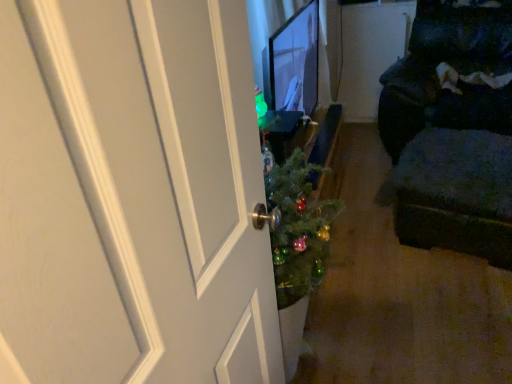
Where is `dark fabric ottoman at right`? The width and height of the screenshot is (512, 384). dark fabric ottoman at right is located at coordinates (456, 193).

I want to click on dark fabric ottoman at right, so click(x=456, y=193).

From the image's perspective, which one is positioned lower, dark fabric couch at right or dark fabric ottoman at right?

dark fabric ottoman at right, from the image's perspective.

Is dark fabric couch at right next to dark fabric ottoman at right and touching it?

No, dark fabric couch at right is not beside dark fabric ottoman at right.

At what (x,y) coordinates should I click in order to perform the action: click on the footrest located in front of the dark fabric couch at right. Please return your answer as a coordinate pair (x, y). This screenshot has height=384, width=512. Looking at the image, I should click on (456, 193).

Do you think dark fabric couch at right is within dark fabric ottoman at right, or outside of it?

dark fabric couch at right exists outside the volume of dark fabric ottoman at right.

Do you think dark fabric ottoman at right is within matte black monitor at center, or outside of it?

dark fabric ottoman at right is located beyond the bounds of matte black monitor at center.

From the picture: Which is in front, dark fabric ottoman at right or matte black monitor at center?

matte black monitor at center is closer to the camera.

Which is farther from the camera, (461, 197) or (304, 47)?

Point (304, 47)

Does dark fabric ottoman at right have a greater height compared to matte black monitor at center?

In fact, dark fabric ottoman at right may be shorter than matte black monitor at center.

From the image's perspective, is matte black monitor at center on top of dark fabric ottoman at right?

Yes, from the image's perspective, matte black monitor at center is over dark fabric ottoman at right.

Considering the sizes of matte black monitor at center and dark fabric ottoman at right in the image, is matte black monitor at center bigger or smaller than dark fabric ottoman at right?

In the image, matte black monitor at center appears to be smaller than dark fabric ottoman at right.

Considering the sizes of matte black monitor at center and dark fabric ottoman at right in the image, is matte black monitor at center wider or thinner than dark fabric ottoman at right?

matte black monitor at center is thinner than dark fabric ottoman at right.

How many degrees apart are the facing directions of matte black monitor at center and dark fabric ottoman at right?

matte black monitor at center and dark fabric ottoman at right are facing 110 degrees away from each other.

From the image's perspective, which is below, dark fabric couch at right or matte black monitor at center?

matte black monitor at center is shown below in the image.

Is matte black monitor at center at the back of dark fabric couch at right?

No, dark fabric couch at right is not facing away from matte black monitor at center.

Is dark fabric couch at right positioned beyond the bounds of matte black monitor at center?

Yes, dark fabric couch at right is located beyond the bounds of matte black monitor at center.

Does point (434, 221) come behind point (298, 27)?

Yes.

How different are the orientations of matte black monitor at center and dark fabric couch at right in degrees?

The facing directions of matte black monitor at center and dark fabric couch at right are 102 degrees apart.

Find the location of `computer monitor above the dark fabric couch at right (from a real-world perspective)`. computer monitor above the dark fabric couch at right (from a real-world perspective) is located at coordinates (293, 63).

From the image's perspective, is matte black monitor at center located above or below dark fabric couch at right?

matte black monitor at center is situated lower than dark fabric couch at right in the image.

Is dark fabric ottoman at right aimed at dark fabric couch at right?

No, dark fabric ottoman at right does not turn towards dark fabric couch at right.

Does point (423, 237) appear closer or farther from the camera than point (504, 69)?

Point (423, 237) appears to be closer to the viewer than point (504, 69).

Do you think dark fabric ottoman at right is within dark fabric couch at right, or outside of it?

dark fabric ottoman at right lies outside dark fabric couch at right.

From the image's perspective, relative to dark fabric couch at right, is dark fabric ottoman at right above or below?

From the image's perspective, dark fabric ottoman at right appears below dark fabric couch at right.

Locate an element on the screen. Image resolution: width=512 pixels, height=384 pixels. furniture above the dark fabric ottoman at right (from a real-world perspective) is located at coordinates (453, 129).

In order to click on computer monitor located in front of the dark fabric ottoman at right in this screenshot , I will do pos(293,63).

Estimate the real-world distances between objects in this image. Which object is closer to dark fabric couch at right, dark fabric ottoman at right or matte black monitor at center?

Among the two, dark fabric ottoman at right is located nearer to dark fabric couch at right.

Based on their spatial positions, is matte black monitor at center or dark fabric ottoman at right closer to dark fabric couch at right?

dark fabric ottoman at right is positioned closer to the anchor dark fabric couch at right.

Which object lies further to the anchor point matte black monitor at center, dark fabric couch at right or dark fabric ottoman at right?

Based on the image, dark fabric couch at right appears to be further to matte black monitor at center.

Which object lies nearer to the anchor point dark fabric ottoman at right, matte black monitor at center or dark fabric couch at right?

dark fabric couch at right is positioned closer to the anchor dark fabric ottoman at right.

Based on the photo, estimate the real-world distances between objects in this image. Which object is closer to matte black monitor at center, dark fabric ottoman at right or dark fabric couch at right?

dark fabric ottoman at right is closer to matte black monitor at center.

Which object lies further to the anchor point dark fabric ottoman at right, dark fabric couch at right or matte black monitor at center?

matte black monitor at center lies further to dark fabric ottoman at right than the other object.

Identify the location of footrest between matte black monitor at center and dark fabric couch at right from left to right. Image resolution: width=512 pixels, height=384 pixels. (456, 193).